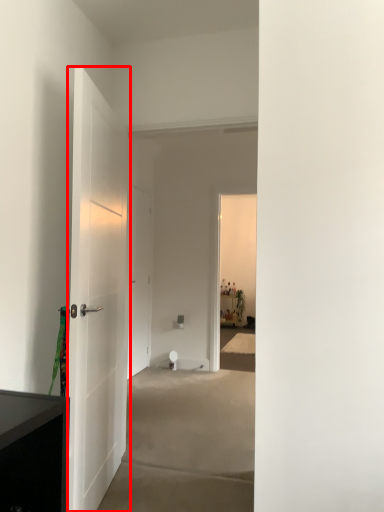
Question: From the image, what is the correct spatial relationship of door (annotated by the red box) in relation to door?

Choices:
 (A) left
 (B) right

Answer: (B)